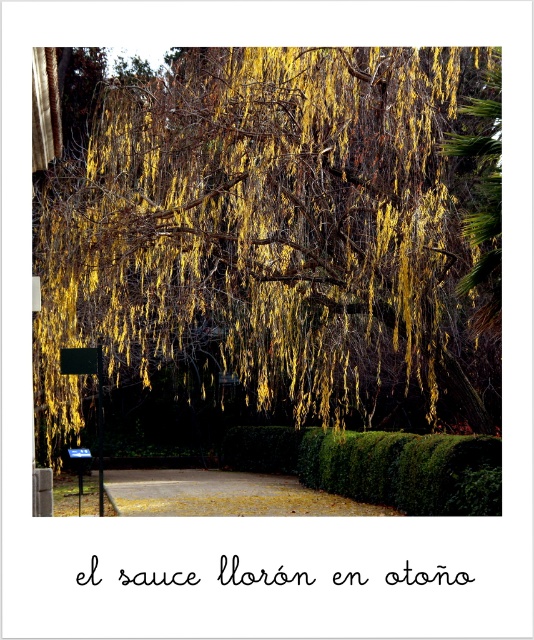
From the picture: Is yellow-green silky leaves at upper center shorter than blue plastic sign at lower left?

No, yellow-green silky leaves at upper center is not shorter than blue plastic sign at lower left.

Which of these two, yellow-green silky leaves at upper center or blue plastic sign at lower left, stands shorter?

blue plastic sign at lower left is shorter.

I want to click on yellow-green silky leaves at upper center, so click(x=265, y=237).

I want to click on yellow-green silky leaves at upper center, so click(x=265, y=237).

Is yellow-green silky leaves at upper center thinner than green leafy hedge at center?

In fact, yellow-green silky leaves at upper center might be wider than green leafy hedge at center.

Who is positioned more to the left, yellow-green silky leaves at upper center or green leafy hedge at center?

yellow-green silky leaves at upper center is more to the left.

This screenshot has width=534, height=640. I want to click on yellow-green silky leaves at upper center, so click(x=265, y=237).

The height and width of the screenshot is (640, 534). Identify the location of yellow-green silky leaves at upper center. (265, 237).

Is point (421, 467) farther from camera compared to point (72, 449)?

That is False.

Is green leafy hedge at center further to the viewer compared to blue plastic sign at lower left?

No, it is in front of blue plastic sign at lower left.

You are a GUI agent. You are given a task and a screenshot of the screen. Output one action in this format:
    pyautogui.click(x=<x>, y=<y>)
    Task: Click on the green leafy hedge at center
    The height and width of the screenshot is (640, 534).
    Given the screenshot: What is the action you would take?
    pyautogui.click(x=405, y=470)